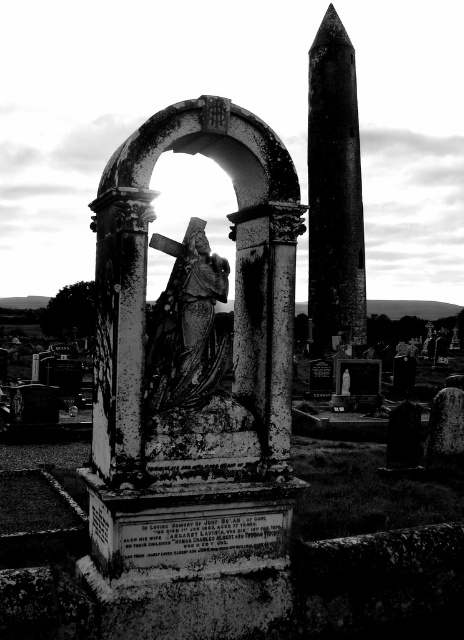
Does smooth stone pillar at upper right appear over rusty metal statue at center?

Yes.

Is point (352, 84) positioned before point (149, 340)?

No, it is behind (149, 340).

Which is behind, point (329, 54) or point (191, 388)?

The point (329, 54) is behind.

Identify the location of smooth stone pillar at upper right. (335, 188).